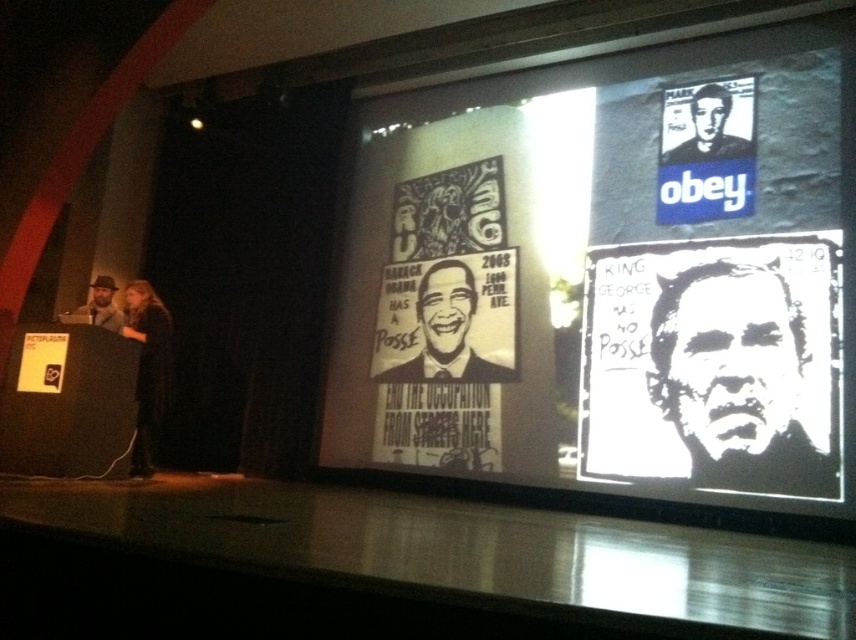
What are the coordinates of the black paper poster at center?

The black paper poster at center is located at coordinates point (446, 332).

From the picture: You are an event organizer setting up a presentation. You have two items to place on the stage backdrop. The first is the white paper posters at upper center and the second is the white paper at center. Based on their sizes, which one should you place first if you want to ensure both fit properly?

The white paper posters at upper center might be wider than the white paper at center, so you should place the wider white paper posters at upper center first to ensure proper placement and avoid overcrowding.

You are an event organizer setting up a presentation. You have two items on stage, the white paper posters at upper center and the white paper at center. Which one is placed higher up?

The white paper posters at upper center is positioned over the white paper at center, meaning it is placed higher up.